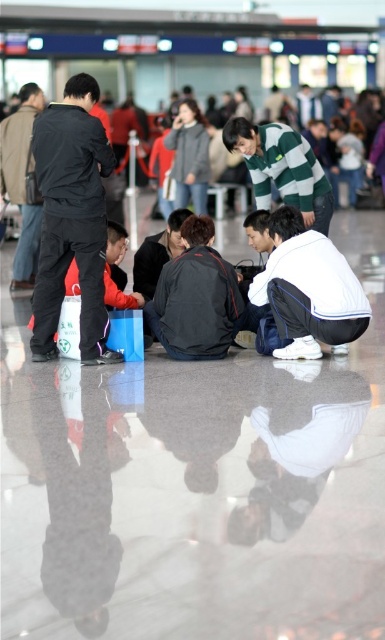
You are a photographer trying to capture both the white matte jacket at center and the dark gray fabric jacket at center in a single frame. Given that your camera can only focus on objects within a 1.2 meter width, will both jackets fit within the frame?

The white matte jacket at center is wider than the dark gray fabric jacket at center. However, since the camera can focus on objects within a 1.2 meter width, both jackets can fit within the frame as long as their combined width does not exceed 1.2 meters. The exact measurement is not provided, so it depends on their individual widths.

You are standing in the transportation hub and see a point marked at coordinates [309,289]. According to the scene description, which object is this point located on?

The point at coordinates [309,289] is located on the white matte jacket at center.

You are a person who needs to pass between the dark gray fabric jacket at center and the dark gray sweater at center. The width of your body is 50 centimeters. Can you fit through the space between them?

The distance between the dark gray fabric jacket at center and the dark gray sweater at center is 61.69 centimeters. Since your body width is 50 centimeters, you can fit through the space between them.